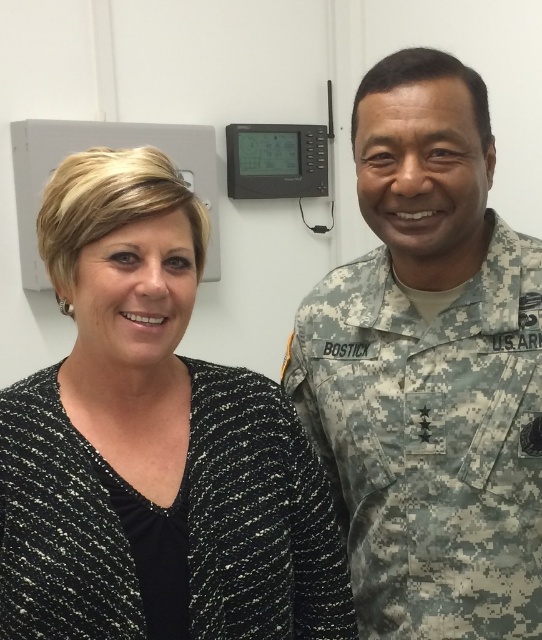
Does black speckled sweater at left come behind camouflage uniform at right?

No, it is in front of camouflage uniform at right.

Does black speckled sweater at left appear over camouflage uniform at right?

Incorrect, black speckled sweater at left is not positioned above camouflage uniform at right.

Between point (253, 493) and point (379, 509), which one is positioned in front?

Point (253, 493)

Find the location of `black speckled sweater at left`. black speckled sweater at left is located at coordinates (153, 445).